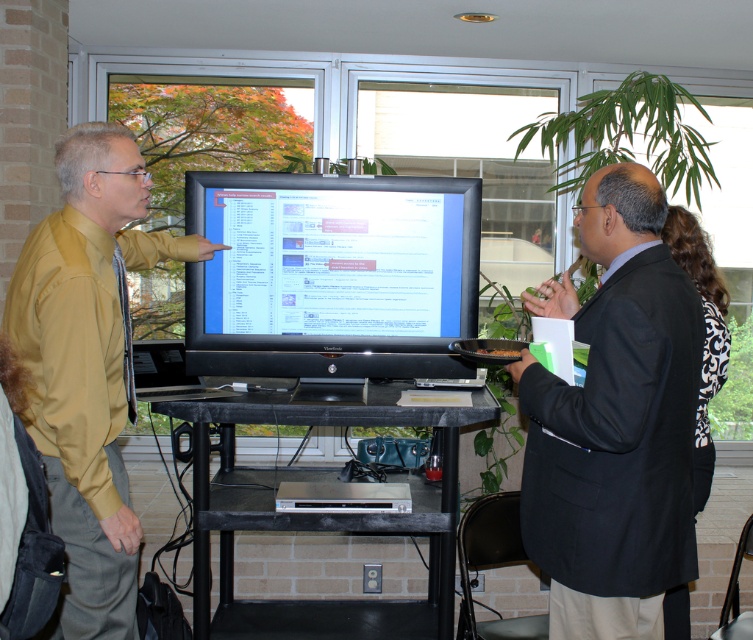
Does matte black monitor at center have a greater width compared to black matte table at center?

Incorrect, matte black monitor at center's width does not surpass black matte table at center's.

Does matte black monitor at center appear under black matte table at center?

Actually, matte black monitor at center is above black matte table at center.

Does point (471, 300) come in front of point (224, 636)?

Yes, point (471, 300) is in front of point (224, 636).

The width and height of the screenshot is (753, 640). What are the coordinates of `matte black monitor at center` in the screenshot? It's located at (331, 275).

Can you confirm if black suit at right is shorter than black damask dress at right?

Incorrect, black suit at right's height does not fall short of black damask dress at right's.

Between black suit at right and black damask dress at right, which one appears on the right side from the viewer's perspective?

Positioned to the right is black damask dress at right.

Between point (605, 180) and point (727, 348), which one is positioned in front?

Point (605, 180) is in front.

Where is `black suit at right`? black suit at right is located at coordinates (614, 422).

Is matte black monitor at center above black damask dress at right?

Yes.

Locate an element on the screen. matte black monitor at center is located at coordinates (331, 275).